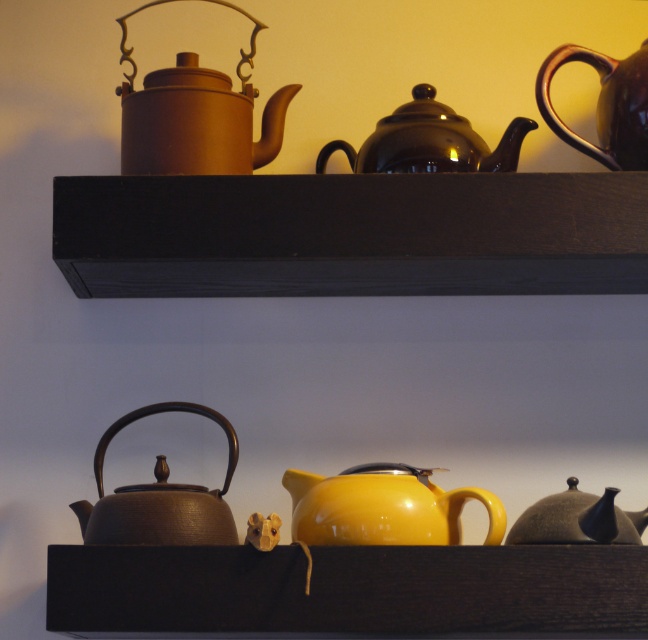
Question: Estimate the real-world distances between objects in this image. Which object is closer to the yellow glossy teapot at center?

Choices:
 (A) matte brown teapot at lower left
 (B) matte brown teapot at upper left
 (C) black wood shelf at upper center
 (D) matte brown teapot at lower right

Answer: (D)

Question: Where is yellow glossy teapot at center located in relation to matte brown teapot at lower left in the image?

Choices:
 (A) right
 (B) left

Answer: (A)

Question: Among these points, which one is nearest to the camera?

Choices:
 (A) (251, 42)
 (B) (397, 470)
 (C) (157, 468)

Answer: (B)

Question: Is black wood shelf at upper center in front of shiny dark brown teapot at upper right?

Choices:
 (A) yes
 (B) no

Answer: (A)

Question: Which point is closer to the camera?

Choices:
 (A) black wood shelf at upper center
 (B) shiny dark brown teapot at upper right
 (C) matte brown teapot at lower right

Answer: (C)

Question: Is matte brown teapot at upper left positioned before yellow glossy teapot at center?

Choices:
 (A) yes
 (B) no

Answer: (B)